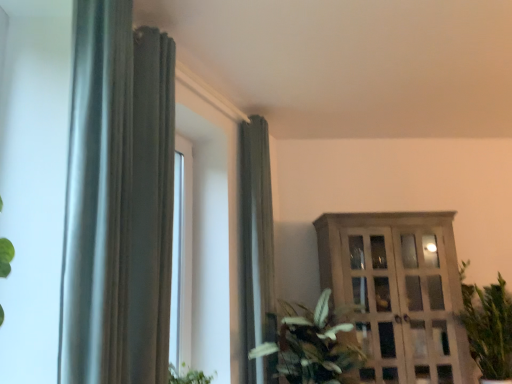
How much space does green leafy plant at center, which is counted as the 2th houseplant, starting from the right, occupy horizontally?

green leafy plant at center, which is counted as the 2th houseplant, starting from the right, is 27.97 inches in width.

In order to face green leafy plant at center, the 1th houseplant in the left-to-right sequence, should I rotate leftwards or rightwards?

To align with it, rotate right about 7.843°.

The height and width of the screenshot is (384, 512). Find the location of `satin gray curtain at center, the 2th curtain viewed from the front`. satin gray curtain at center, the 2th curtain viewed from the front is located at coordinates (257, 248).

Where is `green leafy plant at center, which is counted as the 2th houseplant, starting from the right`? The image size is (512, 384). green leafy plant at center, which is counted as the 2th houseplant, starting from the right is located at coordinates (315, 345).

Which object is further away from the camera, wooden cabinet at right or green leafy plant at center, the 1th houseplant in the left-to-right sequence?

wooden cabinet at right is further away from the camera.

Does wooden cabinet at right have a smaller size compared to green leafy plant at center, which is counted as the 2th houseplant, starting from the right?

No.

Would you say wooden cabinet at right is to the left or to the right of green leafy plant at center, which is counted as the 2th houseplant, starting from the right, in the picture?

From the image, it's evident that wooden cabinet at right is to the right of green leafy plant at center, which is counted as the 2th houseplant, starting from the right.

Would you say green leafy plant at center, the 1th houseplant in the left-to-right sequence, is to the left or to the right of satin gray curtain at center, the first curtain from the back, in the picture?

In the image, green leafy plant at center, the 1th houseplant in the left-to-right sequence, appears on the right side of satin gray curtain at center, the first curtain from the back.

What are the coordinates of `the 1st curtain above the green leafy plant at center, which is counted as the 2th houseplant, starting from the right (from the image's perspective)` in the screenshot? It's located at (257, 248).

From the image's perspective, is green leafy plant at center, the 1th houseplant in the left-to-right sequence, located above or below satin gray curtain at center, the 2th curtain from the left?

Clearly, from the image's perspective, green leafy plant at center, the 1th houseplant in the left-to-right sequence, is below satin gray curtain at center, the 2th curtain from the left.

Can you tell me how much green leafy plant at center, the 1th houseplant in the left-to-right sequence, and satin gray curtain at center, the first curtain from the back, differ in facing direction?

green leafy plant at center, the 1th houseplant in the left-to-right sequence, and satin gray curtain at center, the first curtain from the back, are facing 30.6 degrees away from each other.

Looking at this image, in the image, is satin gray curtain at center, the first curtain viewed from the right, positioned in front of or behind wooden cabinet at right?

satin gray curtain at center, the first curtain viewed from the right, is positioned closer to the viewer than wooden cabinet at right.

Between point (275, 368) and point (397, 322), which one is positioned behind?

The point (397, 322) is farther from the camera.

How different are the orientations of satin gray curtain at center, the first curtain from the back, and wooden cabinet at right in degrees?

satin gray curtain at center, the first curtain from the back, and wooden cabinet at right are facing 67.7 degrees away from each other.

Is satin gray curtain at center, the 2th curtain viewed from the front, wider than wooden cabinet at right?

No, satin gray curtain at center, the 2th curtain viewed from the front, is not wider than wooden cabinet at right.

From a real-world perspective, is green leafy plant at right, marked as the second houseplant in a left-to-right arrangement, beneath green leafy plant at center, the 1th houseplant in the left-to-right sequence?

Incorrect, from a real-world perspective, green leafy plant at right, marked as the second houseplant in a left-to-right arrangement, is higher than green leafy plant at center, the 1th houseplant in the left-to-right sequence.

Considering the positions of objects green leafy plant at right, marked as the 1th houseplant in a right-to-left arrangement, and green leafy plant at center, the 1th houseplant in the left-to-right sequence, in the image provided, who is behind, green leafy plant at right, marked as the 1th houseplant in a right-to-left arrangement, or green leafy plant at center, the 1th houseplant in the left-to-right sequence,?

green leafy plant at right, marked as the 1th houseplant in a right-to-left arrangement, is behind.

Is green leafy plant at right, marked as the second houseplant in a left-to-right arrangement, bigger than green leafy plant at center, the 1th houseplant in the left-to-right sequence?

Incorrect, green leafy plant at right, marked as the second houseplant in a left-to-right arrangement, is not larger than green leafy plant at center, the 1th houseplant in the left-to-right sequence.

Do you think green leafy plant at right, marked as the 1th houseplant in a right-to-left arrangement, is within green leafy plant at center, the 1th houseplant in the left-to-right sequence, or outside of it?

green leafy plant at right, marked as the 1th houseplant in a right-to-left arrangement, is located beyond the bounds of green leafy plant at center, the 1th houseplant in the left-to-right sequence.

Is the position of wooden cabinet at right more distant than that of satin silver curtain at left, which is counted as the first curtain, starting from the left?

Yes, it is.

Which point is more forward, (324, 236) or (85, 70)?

The point (85, 70) is closer.

Is wooden cabinet at right not near satin silver curtain at left, the second curtain from the right?

That's right, there is a large distance between wooden cabinet at right and satin silver curtain at left, the second curtain from the right.

Locate an element on the screen. dresser that is under the satin silver curtain at left, the 1th curtain viewed from the front (from a real-world perspective) is located at coordinates (399, 293).

From the image's perspective, is wooden cabinet at right located above or below satin gray curtain at center, the 2th curtain viewed from the front?

From the image's perspective, wooden cabinet at right appears below satin gray curtain at center, the 2th curtain viewed from the front.

Is point (457, 374) closer to camera compared to point (267, 221)?

No, (457, 374) is further to viewer.

Is satin gray curtain at center, the first curtain from the back, a part of wooden cabinet at right?

No, satin gray curtain at center, the first curtain from the back, is not surrounded by wooden cabinet at right.

Considering the relative sizes of wooden cabinet at right and satin gray curtain at center, the first curtain viewed from the right, in the image provided, is wooden cabinet at right shorter than satin gray curtain at center, the first curtain viewed from the right,?

Correct, wooden cabinet at right is not as tall as satin gray curtain at center, the first curtain viewed from the right.

Which is more to the right, green leafy plant at right, marked as the 1th houseplant in a right-to-left arrangement, or satin silver curtain at left, which ranks as the 2th curtain in back-to-front order?

Positioned to the right is green leafy plant at right, marked as the 1th houseplant in a right-to-left arrangement.

From a real-world perspective, which curtain is the 2nd one above the green leafy plant at right, marked as the 1th houseplant in a right-to-left arrangement? Please provide its 2D coordinates.

[(118, 200)]

Could satin silver curtain at left, which is counted as the first curtain, starting from the left, be considered to be inside green leafy plant at right, marked as the second houseplant in a left-to-right arrangement?

Actually, satin silver curtain at left, which is counted as the first curtain, starting from the left, is outside green leafy plant at right, marked as the second houseplant in a left-to-right arrangement.

Is green leafy plant at right, marked as the 1th houseplant in a right-to-left arrangement, far from satin silver curtain at left, which is counted as the first curtain, starting from the left?

Yes.

Identify the location of dresser above the green leafy plant at center, which is counted as the 2th houseplant, starting from the right (from a real-world perspective). The height and width of the screenshot is (384, 512). (399, 293).

Locate an element on the screen. This screenshot has width=512, height=384. houseplant that is the 1st one when counting rightward from the satin gray curtain at center, the first curtain viewed from the right is located at coordinates (315, 345).

Looking at the image, which one is located closer to green leafy plant at center, which is counted as the 2th houseplant, starting from the right, wooden cabinet at right or satin silver curtain at left, the second curtain from the right?

wooden cabinet at right is positioned closer to the anchor green leafy plant at center, which is counted as the 2th houseplant, starting from the right.

Based on their spatial positions, is satin gray curtain at center, the 2th curtain from the left, or green leafy plant at right, marked as the 1th houseplant in a right-to-left arrangement, closer to wooden cabinet at right?

Among the two, green leafy plant at right, marked as the 1th houseplant in a right-to-left arrangement, is located nearer to wooden cabinet at right.

Considering their positions, is satin silver curtain at left, which is counted as the first curtain, starting from the left, positioned further to green leafy plant at center, the 1th houseplant in the left-to-right sequence, than satin gray curtain at center, the first curtain viewed from the right?

The object further to green leafy plant at center, the 1th houseplant in the left-to-right sequence, is satin silver curtain at left, which is counted as the first curtain, starting from the left.

Considering their positions, is green leafy plant at center, which is counted as the 2th houseplant, starting from the right, positioned further to satin gray curtain at center, the first curtain from the back, than satin silver curtain at left, which is counted as the first curtain, starting from the left?

Among the two, satin silver curtain at left, which is counted as the first curtain, starting from the left, is located further to satin gray curtain at center, the first curtain from the back.

From the image, which object appears to be farther from wooden cabinet at right, green leafy plant at center, which is counted as the 2th houseplant, starting from the right, or green leafy plant at right, marked as the 1th houseplant in a right-to-left arrangement?

Among the two, green leafy plant at center, which is counted as the 2th houseplant, starting from the right, is located further to wooden cabinet at right.

Estimate the real-world distances between objects in this image. Which object is closer to satin silver curtain at left, the 1th curtain viewed from the front, satin gray curtain at center, the first curtain from the back, or green leafy plant at center, which is counted as the 2th houseplant, starting from the right?

The object closer to satin silver curtain at left, the 1th curtain viewed from the front, is satin gray curtain at center, the first curtain from the back.

Which object lies nearer to the anchor point wooden cabinet at right, green leafy plant at right, marked as the second houseplant in a left-to-right arrangement, or satin silver curtain at left, the second curtain from the right?

green leafy plant at right, marked as the second houseplant in a left-to-right arrangement, lies closer to wooden cabinet at right than the other object.

From the image, which object appears to be nearer to green leafy plant at center, which is counted as the 2th houseplant, starting from the right, satin gray curtain at center, the 2th curtain viewed from the front, or green leafy plant at right, marked as the 1th houseplant in a right-to-left arrangement?

The object closer to green leafy plant at center, which is counted as the 2th houseplant, starting from the right, is satin gray curtain at center, the 2th curtain viewed from the front.

The image size is (512, 384). I want to click on houseplant positioned between satin silver curtain at left, the 1th curtain viewed from the front, and satin gray curtain at center, the first curtain from the back, from near to far, so click(315, 345).

In order to click on dresser between satin silver curtain at left, which is counted as the first curtain, starting from the left, and green leafy plant at right, marked as the 1th houseplant in a right-to-left arrangement in this screenshot , I will do `click(399, 293)`.

This screenshot has height=384, width=512. Find the location of `curtain between satin silver curtain at left, which is counted as the first curtain, starting from the left, and green leafy plant at right, marked as the second houseplant in a left-to-right arrangement, from left to right`. curtain between satin silver curtain at left, which is counted as the first curtain, starting from the left, and green leafy plant at right, marked as the second houseplant in a left-to-right arrangement, from left to right is located at coordinates (257, 248).

At what (x,y) coordinates should I click in order to perform the action: click on houseplant located between satin silver curtain at left, which ranks as the 2th curtain in back-to-front order, and green leafy plant at right, marked as the second houseplant in a left-to-right arrangement, in the left-right direction. Please return your answer as a coordinate pair (x, y). This screenshot has height=384, width=512. Looking at the image, I should click on pos(315,345).